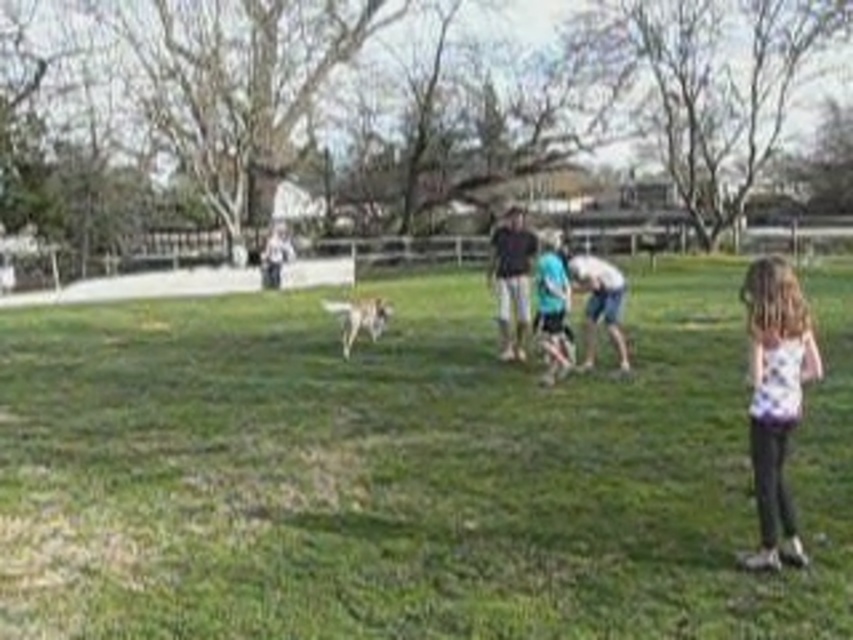
Image resolution: width=853 pixels, height=640 pixels. What do you see at coordinates (776, 397) in the screenshot?
I see `white printed shirt at right` at bounding box center [776, 397].

Find the location of a particular element. The width and height of the screenshot is (853, 640). white printed shirt at right is located at coordinates (776, 397).

Does green grassy field at center have a larger size compared to black cotton shirt at center?

Yes.

Image resolution: width=853 pixels, height=640 pixels. What do you see at coordinates (408, 470) in the screenshot?
I see `green grassy field at center` at bounding box center [408, 470].

Measure the distance between point [793,458] and camera.

A distance of 10.03 meters exists between point [793,458] and camera.

Locate an element on the screen. The width and height of the screenshot is (853, 640). green grassy field at center is located at coordinates (408, 470).

Does point (514, 252) come closer to viewer compared to point (329, 307)?

Yes, it is in front of point (329, 307).

Can you confirm if black cotton shirt at center is wider than white fur dog at center?

Yes, black cotton shirt at center is wider than white fur dog at center.

Is point (527, 257) behind point (323, 305)?

That is False.

This screenshot has height=640, width=853. What are the coordinates of `black cotton shirt at center` in the screenshot? It's located at (512, 280).